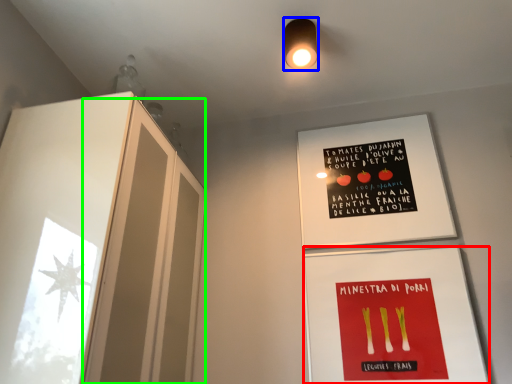
Question: Which is farther away from flyer (highlighted by a red box)? light fixture (highlighted by a blue box) or glass door (highlighted by a green box)?

Choices:
 (A) light fixture
 (B) glass door

Answer: (A)